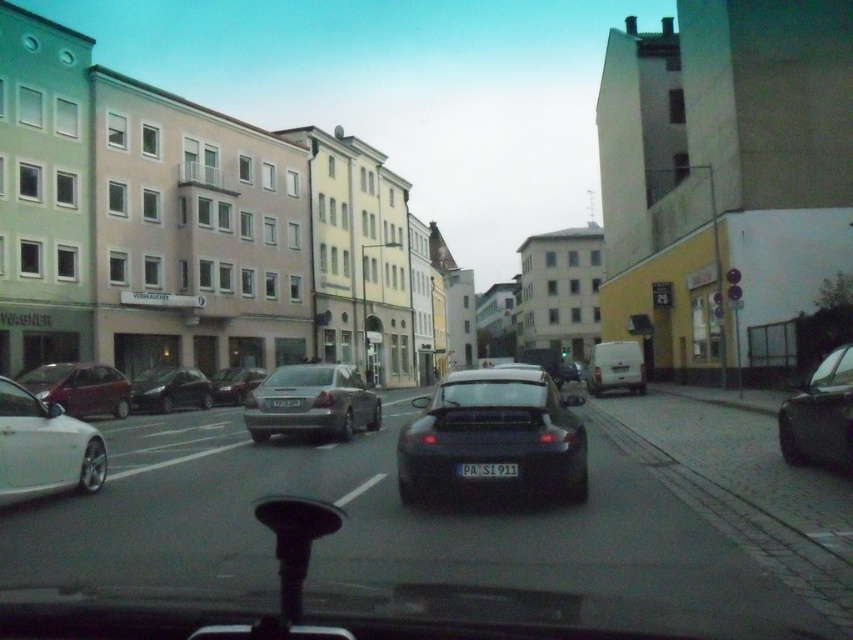
You are a driver in a car and you see the point at coordinates (x=494, y=435) in front of you. Which vehicle is this point located on?

The point at coordinates (x=494, y=435) is located on the satin black car at center.

You are driving and want to make a left turn onto a side street ahead. There is a satin black car at center in your lane. Can you safely pass around it to the right to make the turn?

The satin black car at center is located at point [494,435], which means it is positioned near the center of the road. However, there is a parked black car on the right side of the road, so passing to the right might not be possible due to the parked vehicle. You should wait behind the satin black car at center until it moves or look for another opportunity to change lanes safely before the turn.

You are driving and want to make a left turn onto a side street that is 2 meters wide. The satin black car at center is blocking your path. Can you safely maneuver around it without crossing into the oncoming traffic lane?

The satin black car at center is positioned at coordinates (494,435). Since it is at the center of the road, you can safely move around it by staying in your lane and ensuring there is enough space to pass without encroaching into the oncoming traffic lane. However, you must check for sufficient clearance before proceeding.